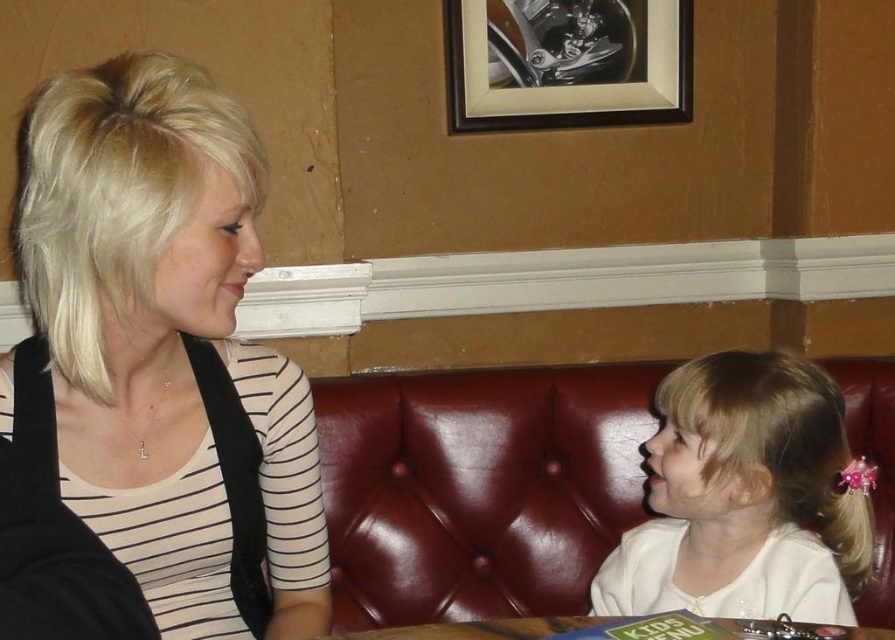
Question: Is matte black hair at left above wooden framed print at upper center?

Choices:
 (A) yes
 (B) no

Answer: (B)

Question: Observing the image, what is the correct spatial positioning of matte black hair at left in reference to wooden framed print at upper center?

Choices:
 (A) above
 (B) below

Answer: (B)

Question: Which is farther from the matte black hair at left?

Choices:
 (A) wooden framed print at upper center
 (B) white matte hair clip at right
 (C) wooden table at lower center

Answer: (A)

Question: Which point is closer to the camera taking this photo?

Choices:
 (A) pyautogui.click(x=472, y=632)
 (B) pyautogui.click(x=618, y=10)

Answer: (A)

Question: Which object is farther from the camera taking this photo?

Choices:
 (A) white matte hair clip at right
 (B) wooden table at lower center
 (C) wooden framed print at upper center

Answer: (C)

Question: Is white matte hair clip at right below wooden framed print at upper center?

Choices:
 (A) no
 (B) yes

Answer: (B)